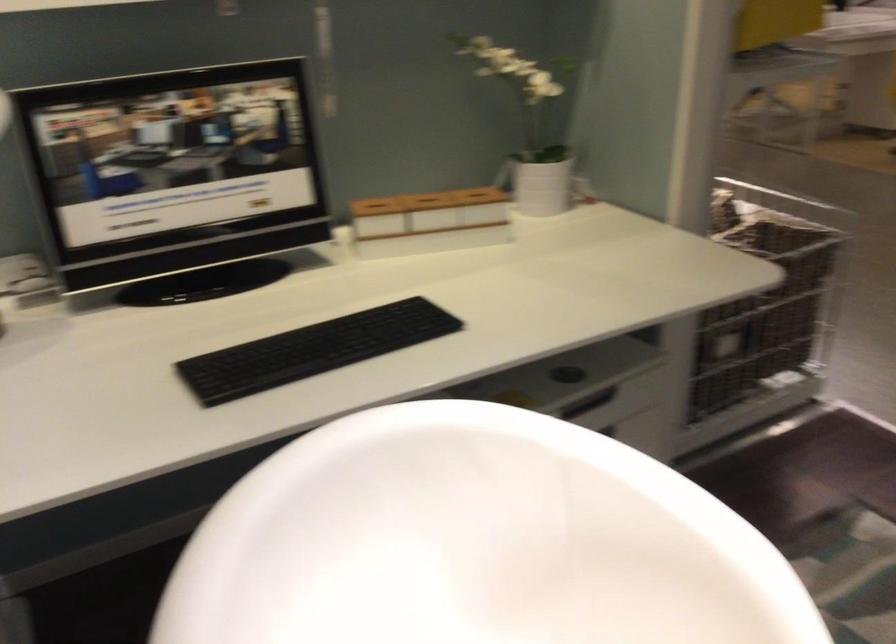
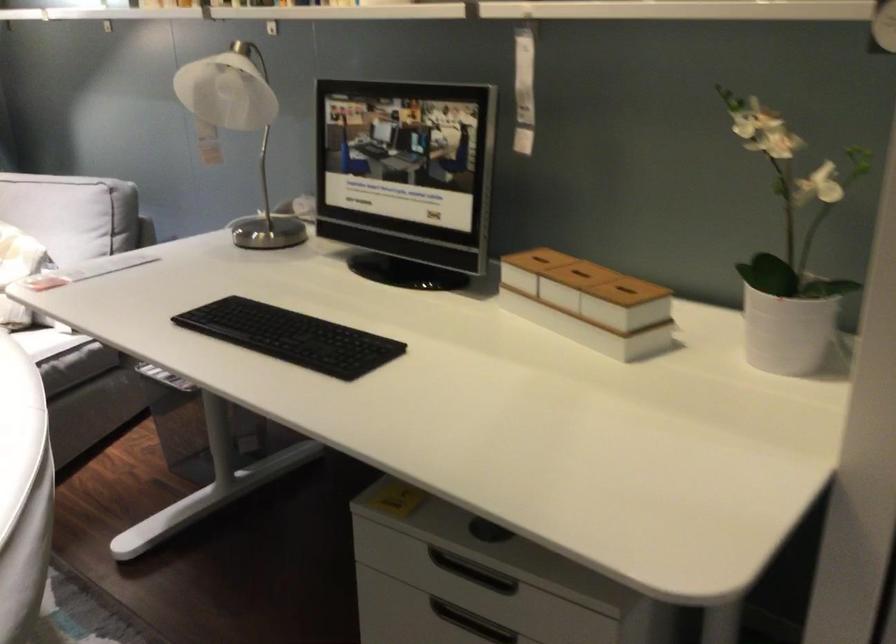
Find the pixel in the second image that matches point 642,466 in the first image.

(22, 489)